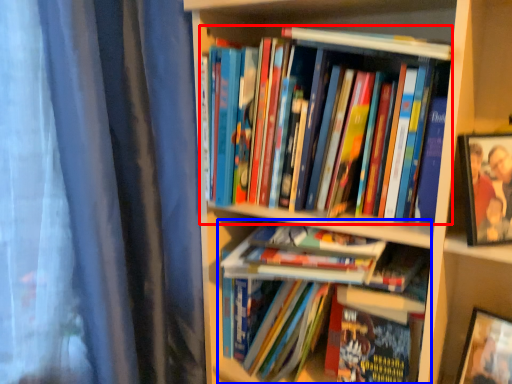
Question: Among these objects, which one is nearest to the camera, book (highlighted by a red box) or book (highlighted by a blue box)?

Choices:
 (A) book
 (B) book

Answer: (A)